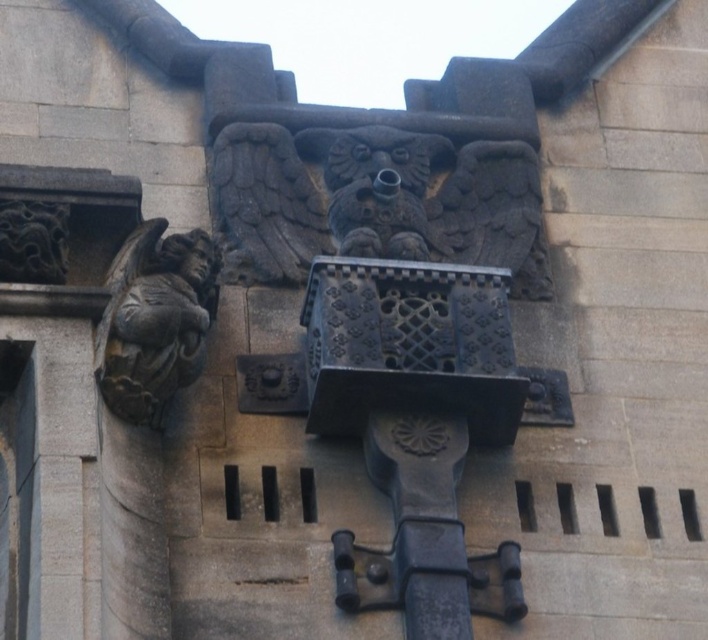
Between dark gray stone gargoyle at left and black stone dragon at upper left, which one has more height?

Standing taller between the two is black stone dragon at upper left.

Looking at this image, does dark gray stone gargoyle at left appear on the left side of black stone dragon at upper left?

In fact, dark gray stone gargoyle at left is to the right of black stone dragon at upper left.

Measure the distance between point (176, 285) and camera.

The distance of point (176, 285) from camera is 205.32 feet.

This screenshot has width=708, height=640. In order to click on dark gray stone gargoyle at left in this screenshot , I will do `click(154, 317)`.